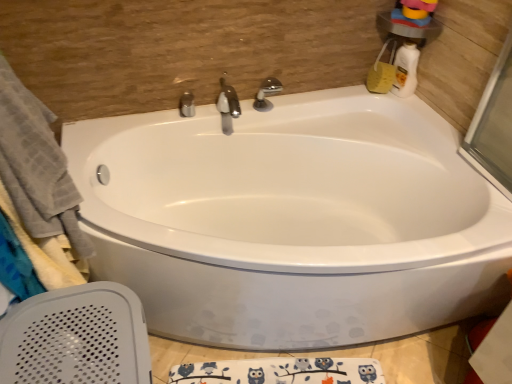
This screenshot has width=512, height=384. I want to click on empty space that is to the right of polished chrome faucet at upper center, acting as the 1th tap starting from the right, so click(297, 105).